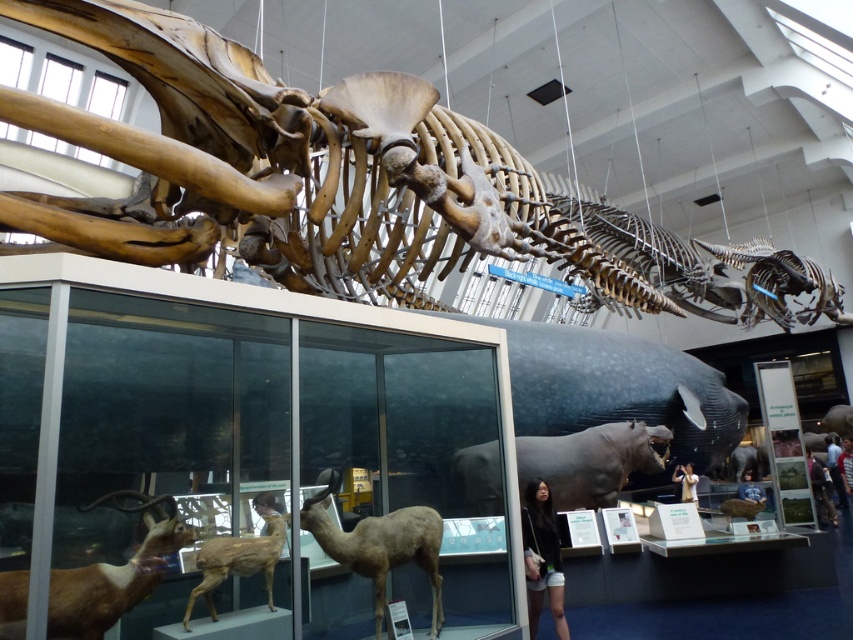
Who is lower down, brown matte deer at center or brown matte/deer at center?

brown matte deer at center is below.

Locate an element on the screen. The height and width of the screenshot is (640, 853). brown matte deer at center is located at coordinates (379, 545).

Between point (412, 534) and point (280, 534), which one is positioned behind?

Point (412, 534)

The height and width of the screenshot is (640, 853). I want to click on brown matte deer at center, so click(x=379, y=545).

Which is behind, point (619, 472) or point (247, 536)?

Point (619, 472)

Can you confirm if brown matte hippo at center is taller than brown matte/deer at center?

Correct, brown matte hippo at center is much taller as brown matte/deer at center.

Is point (651, 445) in front of point (223, 561)?

No.

Image resolution: width=853 pixels, height=640 pixels. In order to click on brown matte hippo at center in this screenshot , I will do `click(589, 461)`.

Does brown matte/deer at lower left appear on the right side of brown matte/deer at center?

Incorrect, brown matte/deer at lower left is not on the right side of brown matte/deer at center.

Looking at this image, between brown matte/deer at lower left and brown matte/deer at center, which one is positioned higher?

brown matte/deer at lower left is above.

At what (x,y) coordinates should I click in order to perform the action: click on brown matte/deer at lower left. Please return your answer as a coordinate pair (x, y). This screenshot has height=640, width=853. Looking at the image, I should click on pyautogui.click(x=113, y=579).

Where is `brown matte/deer at lower left`? Image resolution: width=853 pixels, height=640 pixels. brown matte/deer at lower left is located at coordinates (113, 579).